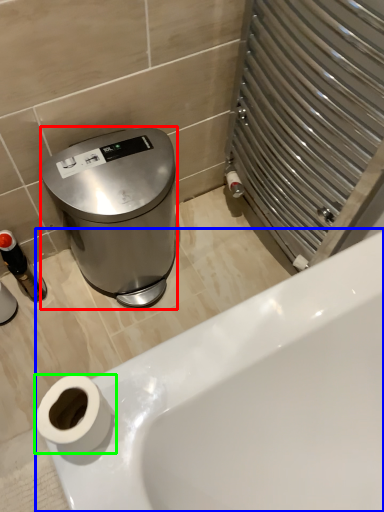
Question: Which object is the closest to the appliance (highlighted by a red box)? Choose among these: bathtub (highlighted by a blue box) or toilet paper (highlighted by a green box).

Choices:
 (A) bathtub
 (B) toilet paper

Answer: (A)